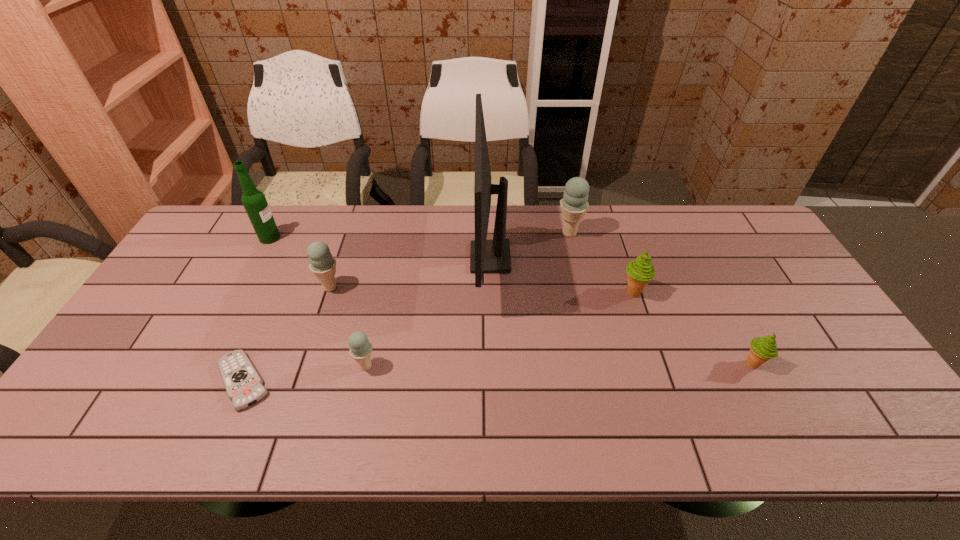
At what (x,y) coordinates should I click in order to perform the action: click on the fourth object from right to left. Please return your answer as a coordinate pair (x, y). The width and height of the screenshot is (960, 540). Looking at the image, I should click on (493, 256).

Locate an element on the screen. the tallest object is located at coordinates (493, 256).

At what (x,y) coordinates should I click in order to perform the action: click on green beer bottle. Please return your answer as a coordinate pair (x, y). The image size is (960, 540). Looking at the image, I should click on (254, 201).

Where is `the leftmost object`? Image resolution: width=960 pixels, height=540 pixels. the leftmost object is located at coordinates (254, 201).

Find the location of a particular element. The width and height of the screenshot is (960, 540). the tallest icecream is located at coordinates (574, 205).

Locate an element on the screen. Image resolution: width=960 pixels, height=540 pixels. the rightmost blue ice cream is located at coordinates (574, 205).

Locate an element on the screen. the farther green icecream is located at coordinates (640, 271).

Image resolution: width=960 pixels, height=540 pixels. I want to click on the left green icecream, so click(x=640, y=271).

Where is `the second biggest blue ice cream`? the second biggest blue ice cream is located at coordinates (322, 264).

This screenshot has width=960, height=540. Identify the location of the third object from left to right. (322, 264).